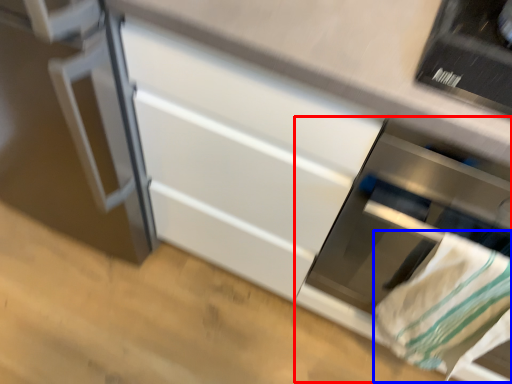
Question: Which of the following is the closest to the observer, oven (highlighted by a red box) or blanket (highlighted by a blue box)?

Choices:
 (A) oven
 (B) blanket

Answer: (A)